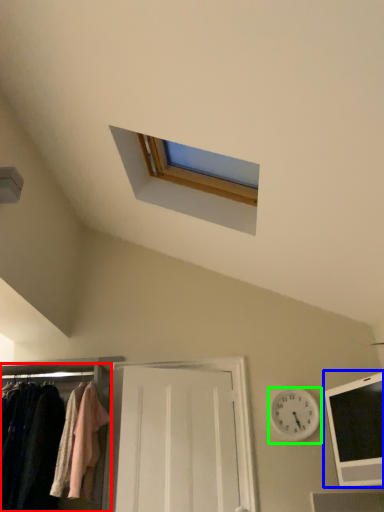
Question: Which is nearer to the closet (highlighted by a red box)? hole (highlighted by a blue box) or clock (highlighted by a green box).

Choices:
 (A) hole
 (B) clock

Answer: (B)